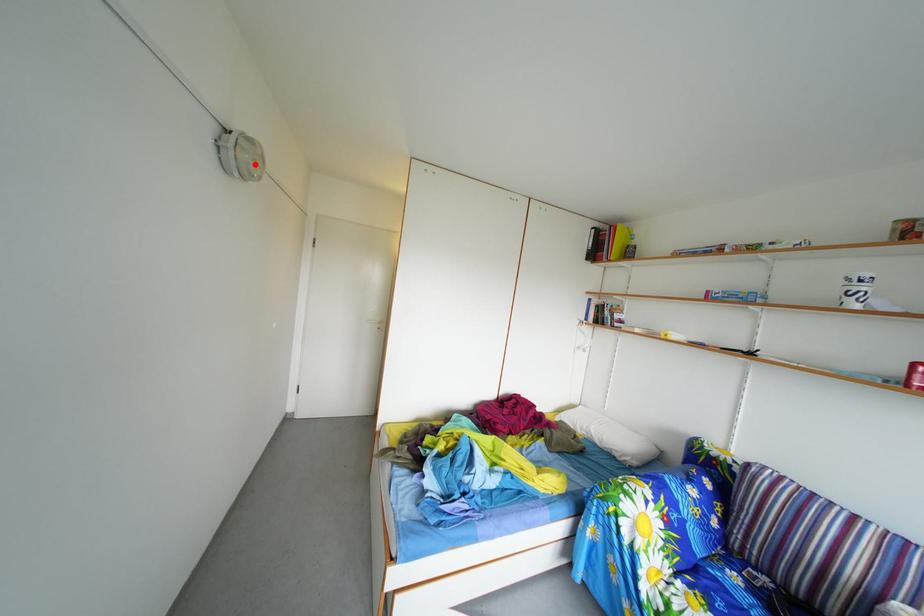
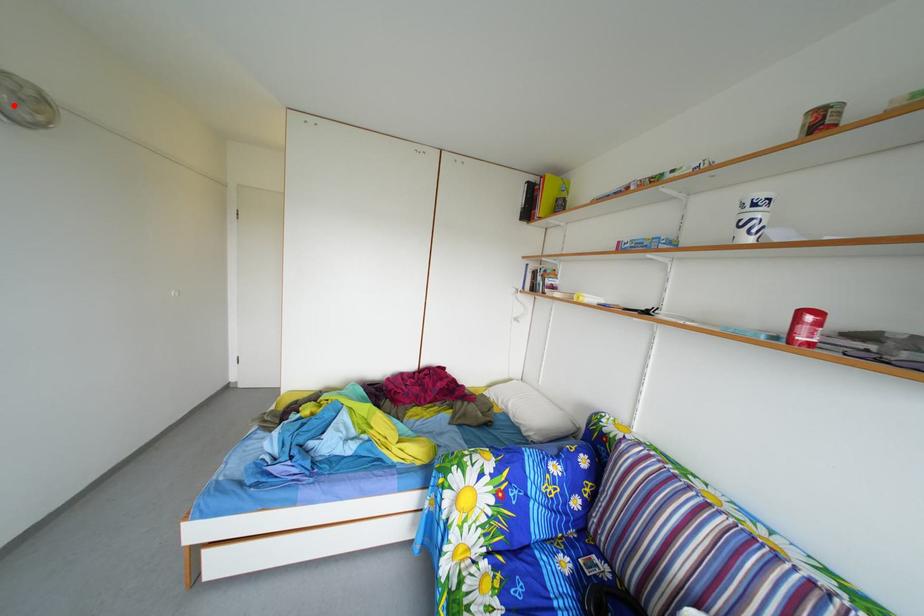
I am providing you with two images of the same scene from different viewpoints. A red point is marked on the first image and another point is marked on the second image. Are the points marked in image1 and image2 representing the same 3D position?

Yes